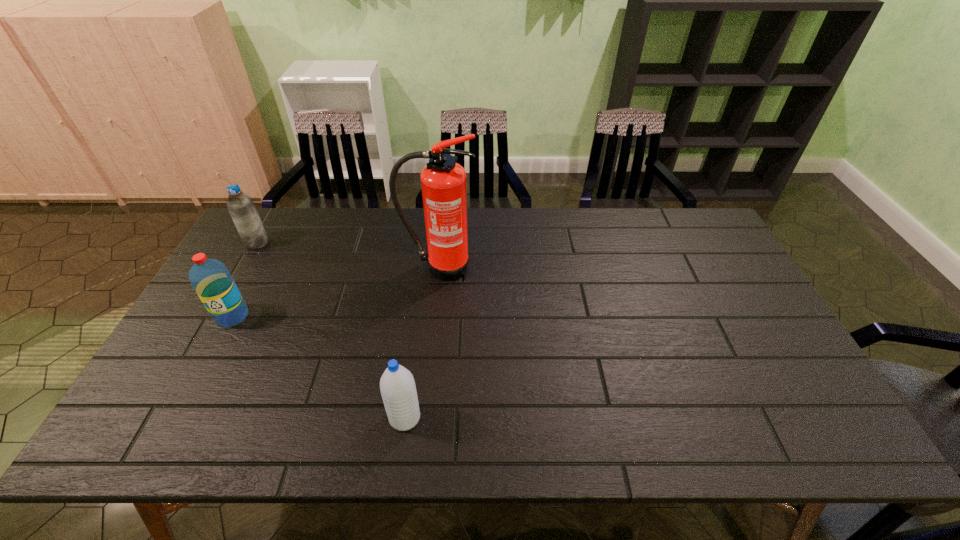
The width and height of the screenshot is (960, 540). I want to click on free space between the farthest object and the nearest object, so click(x=331, y=330).

At what (x,y) coordinates should I click in order to perform the action: click on blank region between the second farthest water bottle and the tallest object. Please return your answer as a coordinate pair (x, y). Looking at the image, I should click on (336, 292).

Identify the location of unoccupied area between the farthest water bottle and the tallest object. This screenshot has height=540, width=960. (348, 255).

Find the location of a particular element. vacant region between the nearest object and the farthest water bottle is located at coordinates (331, 330).

Where is `free spot between the rightmost water bottle and the second nearest object`? The image size is (960, 540). free spot between the rightmost water bottle and the second nearest object is located at coordinates (319, 367).

Where is `free point between the farthest object and the nearest object`? Image resolution: width=960 pixels, height=540 pixels. free point between the farthest object and the nearest object is located at coordinates (331, 330).

Locate an element on the screen. vacant area that lies between the rightmost water bottle and the farthest object is located at coordinates (331, 330).

The image size is (960, 540). I want to click on object that ranks as the second closest to the farthest object, so click(443, 181).

Select which object appears as the third closest to the fire extinguisher. Please provide its 2D coordinates. Your answer should be formatted as a tuple, i.e. [(x, y)], where the tuple contains the x and y coordinates of a point satisfying the conditions above.

[(240, 206)]

Select which water bottle is the second closest to the second farthest water bottle. Please provide its 2D coordinates. Your answer should be formatted as a tuple, i.e. [(x, y)], where the tuple contains the x and y coordinates of a point satisfying the conditions above.

[(397, 385)]